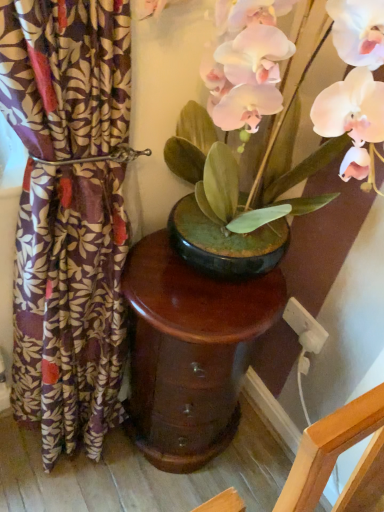
The height and width of the screenshot is (512, 384). Identify the location of free location above glossy wood table at center (from a real-world perspective). (206, 287).